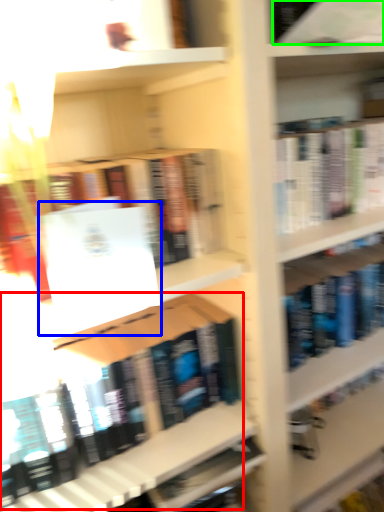
Question: Estimate the real-world distances between objects in this image. Which object is closer to book (highlighted by a red box), paperback book (highlighted by a blue box) or book (highlighted by a green box)?

Choices:
 (A) paperback book
 (B) book

Answer: (A)